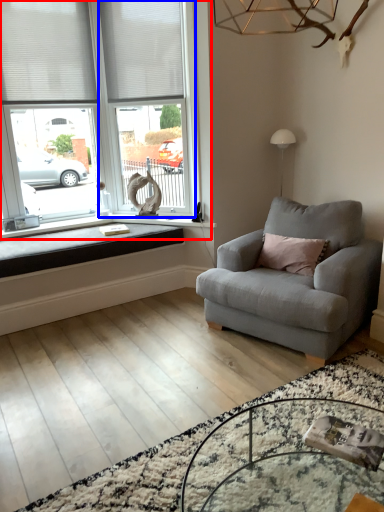
Question: Which of the following is the closest to the observer, window (highlighted by a red box) or window frame (highlighted by a blue box)?

Choices:
 (A) window
 (B) window frame

Answer: (A)